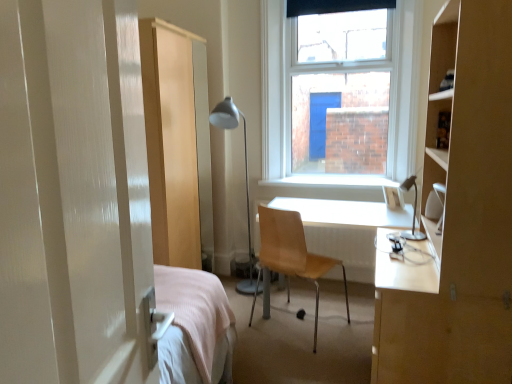
The image size is (512, 384). What do you see at coordinates (245, 176) in the screenshot?
I see `matte silver floor lamp at center, which is counted as the 1th table lamp, starting from the back` at bounding box center [245, 176].

The image size is (512, 384). What do you see at coordinates (292, 253) in the screenshot?
I see `wooden chair at center` at bounding box center [292, 253].

This screenshot has width=512, height=384. What do you see at coordinates (413, 211) in the screenshot?
I see `matte silver table lamp at right, the second table lamp from the left` at bounding box center [413, 211].

The width and height of the screenshot is (512, 384). Describe the element at coordinates (331, 181) in the screenshot. I see `white smooth window sill at center` at that location.

Locate an element on the screen. This screenshot has width=512, height=384. matte silver floor lamp at center, which is counted as the 1th table lamp, starting from the back is located at coordinates [245, 176].

Is matte silver floor lamp at center, which appears as the first table lamp when viewed from the left, positioned with its back to matte silver table lamp at right, arranged as the 1th table lamp when viewed from the front?

matte silver floor lamp at center, which appears as the first table lamp when viewed from the left, does not have its back to matte silver table lamp at right, arranged as the 1th table lamp when viewed from the front.

Which of these two, matte silver floor lamp at center, which is counted as the 1th table lamp, starting from the back, or matte silver table lamp at right, the second table lamp from the left, stands taller?

matte silver floor lamp at center, which is counted as the 1th table lamp, starting from the back.

Is matte silver floor lamp at center, which appears as the first table lamp when viewed from the left, in contact with matte silver table lamp at right, the second table lamp from the left?

There is a gap between matte silver floor lamp at center, which appears as the first table lamp when viewed from the left, and matte silver table lamp at right, the second table lamp from the left.

How many degrees apart are the facing directions of matte silver floor lamp at center, which is the 2th table lamp from right to left, and matte silver table lamp at right, arranged as the 1th table lamp when viewed from the front?

The angle between the facing direction of matte silver floor lamp at center, which is the 2th table lamp from right to left, and the facing direction of matte silver table lamp at right, arranged as the 1th table lamp when viewed from the front, is 90 degrees.

Do you think wooden chair at center is within matte silver table lamp at right, the second table lamp from the left, or outside of it?

wooden chair at center is spatially situated outside matte silver table lamp at right, the second table lamp from the left.

From a real-world perspective, which object rests below the other?

wooden chair at center.

Is wooden chair at center next to matte silver table lamp at right, the 2th table lamp viewed from the back, and touching it?

No, wooden chair at center is not in contact with matte silver table lamp at right, the 2th table lamp viewed from the back.

Who is more distant, wooden chair at center or matte silver table lamp at right, arranged as the 1th table lamp when viewed from the front?

wooden chair at center.

What's the angular difference between matte silver table lamp at right, the 2th table lamp viewed from the back, and matte silver floor lamp at center, which is the 2th table lamp from right to left,'s facing directions?

The angular difference between matte silver table lamp at right, the 2th table lamp viewed from the back, and matte silver floor lamp at center, which is the 2th table lamp from right to left, is 90 degrees.

Consider the image. Would you consider matte silver table lamp at right, the 2th table lamp viewed from the back, to be distant from matte silver floor lamp at center, which is counted as the 1th table lamp, starting from the back?

Yes, matte silver table lamp at right, the 2th table lamp viewed from the back, and matte silver floor lamp at center, which is counted as the 1th table lamp, starting from the back, are quite far apart.

Could you tell me if matte silver table lamp at right, arranged as the 1th table lamp when viewed from the front, is turned towards matte silver floor lamp at center, which appears as the first table lamp when viewed from the left?

No, matte silver table lamp at right, arranged as the 1th table lamp when viewed from the front, is not aimed at matte silver floor lamp at center, which appears as the first table lamp when viewed from the left.

How far apart are matte silver table lamp at right, arranged as the 1th table lamp when viewed from the front, and matte silver floor lamp at center, which is the 2th table lamp from right to left?

matte silver table lamp at right, arranged as the 1th table lamp when viewed from the front, is 1.52 meters from matte silver floor lamp at center, which is the 2th table lamp from right to left.

Does matte silver table lamp at right, the 1th table lamp viewed from the right, have a greater height compared to wooden chair at center?

No.

Would you consider matte silver table lamp at right, the 2th table lamp viewed from the back, to be distant from wooden chair at center?

No, there isn't a large distance between matte silver table lamp at right, the 2th table lamp viewed from the back, and wooden chair at center.

How much distance is there between matte silver table lamp at right, the second table lamp from the left, and wooden chair at center?

They are 25.76 inches apart.

Would you say matte silver table lamp at right, the second table lamp from the left, is to the left or to the right of wooden chair at center in the picture?

Based on their positions, matte silver table lamp at right, the second table lamp from the left, is located to the right of wooden chair at center.

Is matte silver floor lamp at center, which is the 2th table lamp from right to left, turned away from white smooth window sill at center?

matte silver floor lamp at center, which is the 2th table lamp from right to left, is not turned away from white smooth window sill at center.

In terms of width, does matte silver floor lamp at center, which appears as the first table lamp when viewed from the left, look wider or thinner when compared to white smooth window sill at center?

matte silver floor lamp at center, which appears as the first table lamp when viewed from the left, is wider than white smooth window sill at center.

Can white smooth window sill at center be found inside matte silver floor lamp at center, which is counted as the 1th table lamp, starting from the back?

Actually, white smooth window sill at center is outside matte silver floor lamp at center, which is counted as the 1th table lamp, starting from the back.

From the image's perspective, is matte silver floor lamp at center, which is counted as the 1th table lamp, starting from the back, above white smooth window sill at center?

No, from the image's perspective, matte silver floor lamp at center, which is counted as the 1th table lamp, starting from the back, is not over white smooth window sill at center.

From a real-world perspective, between white glossy desk at center and white smooth window sill at center, who is vertically higher?

From a 3D spatial view, white smooth window sill at center is above.

Considering the relative positions of white glossy desk at center and white smooth window sill at center in the image provided, is white glossy desk at center in front of white smooth window sill at center?

That is True.

Is white glossy desk at center thinner than white smooth window sill at center?

In fact, white glossy desk at center might be wider than white smooth window sill at center.

From the image's perspective, who appears lower, white glossy desk at center or white smooth window sill at center?

From the image's view, white glossy desk at center is below.

The height and width of the screenshot is (384, 512). What are the coordinates of `table lamp on the left of white glossy desk at center` in the screenshot? It's located at (245, 176).

From a real-world perspective, is matte silver floor lamp at center, the second table lamp in the front-to-back sequence, located beneath white glossy desk at center?

No, from a real-world perspective, matte silver floor lamp at center, the second table lamp in the front-to-back sequence, is not under white glossy desk at center.

Which is behind, matte silver floor lamp at center, which is counted as the 1th table lamp, starting from the back, or white glossy desk at center?

matte silver floor lamp at center, which is counted as the 1th table lamp, starting from the back, is more distant.

Which of these two, matte silver floor lamp at center, which is counted as the 1th table lamp, starting from the back, or white glossy desk at center, is bigger?

With larger size is white glossy desk at center.

You are a GUI agent. You are given a task and a screenshot of the screen. Output one action in this format:
    pyautogui.click(x=<x>, y=<y>)
    Task: Click on the table lamp above the matte silver table lamp at right, the 2th table lamp viewed from the back (from the image's perspective)
    
    Given the screenshot: What is the action you would take?
    pyautogui.click(x=245, y=176)

Image resolution: width=512 pixels, height=384 pixels. I want to click on chair to the left of matte silver table lamp at right, the 1th table lamp viewed from the right, so click(x=292, y=253).

From the image, which object appears to be farther from white glossy desk at center, matte silver table lamp at right, the second table lamp from the left, or matte silver floor lamp at center, the second table lamp in the front-to-back sequence?

matte silver floor lamp at center, the second table lamp in the front-to-back sequence, is positioned further to the anchor white glossy desk at center.

Which object lies nearer to the anchor point white glossy desk at center, white smooth window sill at center or matte silver table lamp at right, the 1th table lamp viewed from the right?

Among the two, white smooth window sill at center is located nearer to white glossy desk at center.

Looking at the image, which one is located further to white glossy desk at center, matte silver floor lamp at center, which appears as the first table lamp when viewed from the left, or white smooth window sill at center?

matte silver floor lamp at center, which appears as the first table lamp when viewed from the left.

Looking at the image, which one is located further to wooden chair at center, white glossy desk at center or white smooth window sill at center?

The object further to wooden chair at center is white smooth window sill at center.

Looking at the image, which one is located closer to white glossy desk at center, white smooth window sill at center or matte silver floor lamp at center, which appears as the first table lamp when viewed from the left?

white smooth window sill at center is positioned closer to the anchor white glossy desk at center.

Considering their positions, is white glossy desk at center positioned closer to matte silver table lamp at right, arranged as the 1th table lamp when viewed from the front, than white smooth window sill at center?

Based on the image, white glossy desk at center appears to be nearer to matte silver table lamp at right, arranged as the 1th table lamp when viewed from the front.

Looking at the image, which one is located further to matte silver floor lamp at center, which appears as the first table lamp when viewed from the left, wooden chair at center or matte silver table lamp at right, arranged as the 1th table lamp when viewed from the front?

Based on the image, matte silver table lamp at right, arranged as the 1th table lamp when viewed from the front, appears to be further to matte silver floor lamp at center, which appears as the first table lamp when viewed from the left.

Based on their spatial positions, is wooden chair at center or matte silver table lamp at right, the second table lamp from the left, closer to white glossy desk at center?

wooden chair at center is closer to white glossy desk at center.

The image size is (512, 384). Find the location of `chair between matte silver floor lamp at center, the second table lamp in the front-to-back sequence, and white glossy desk at center, in the horizontal direction`. chair between matte silver floor lamp at center, the second table lamp in the front-to-back sequence, and white glossy desk at center, in the horizontal direction is located at coordinates (292, 253).

What are the coordinates of `table lamp between wooden chair at center and white smooth window sill at center from front to back` in the screenshot? It's located at coord(245,176).

I want to click on desk between matte silver floor lamp at center, the second table lamp in the front-to-back sequence, and white smooth window sill at center, so click(346, 229).

Where is `desk positioned between wooden chair at center and white smooth window sill at center from near to far`? The image size is (512, 384). desk positioned between wooden chair at center and white smooth window sill at center from near to far is located at coordinates (346, 229).